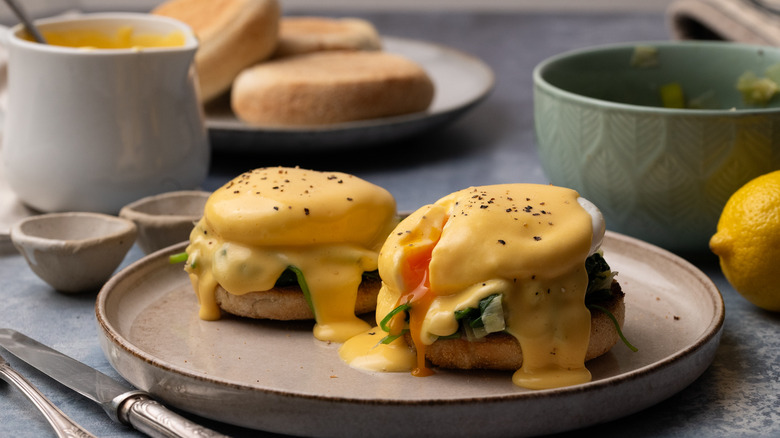
The width and height of the screenshot is (780, 438). I want to click on sauce cups, so click(73, 244), click(176, 216).